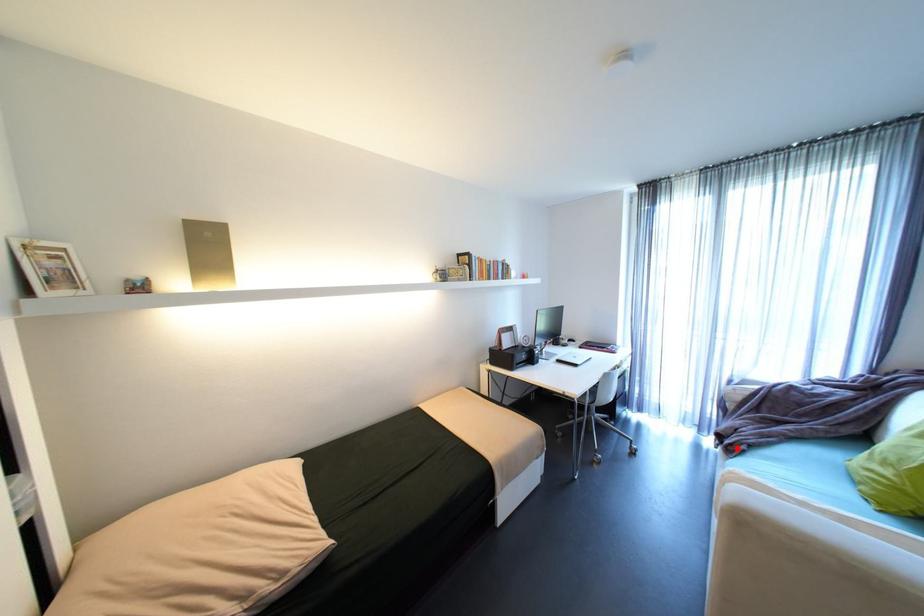
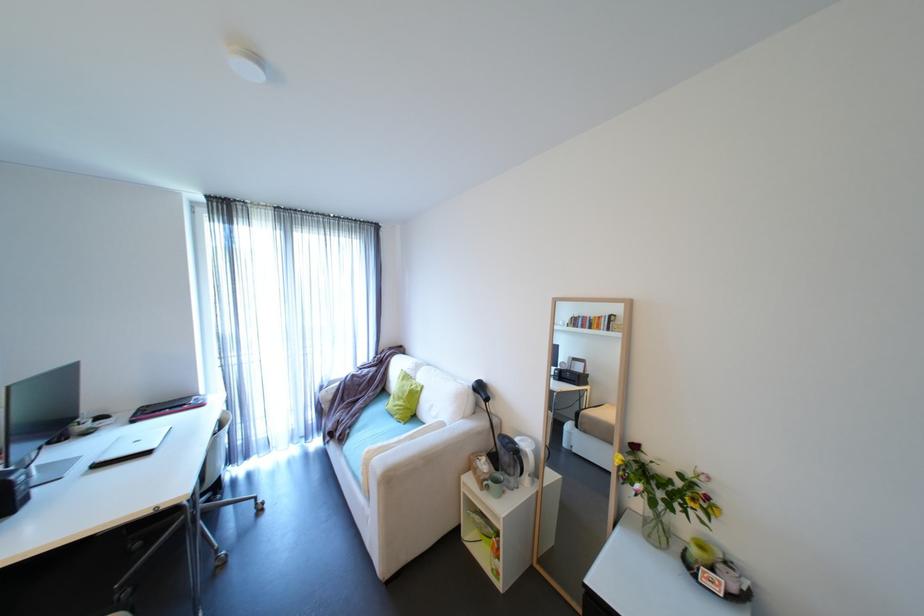
Question: I am providing you with two images of the same scene from different viewpoints. In image1, a red point is highlighted. Considering the same 3D point in image2, which of the following is correct?

Choices:
 (A) It is closer
 (B) It is farther

Answer: (B)